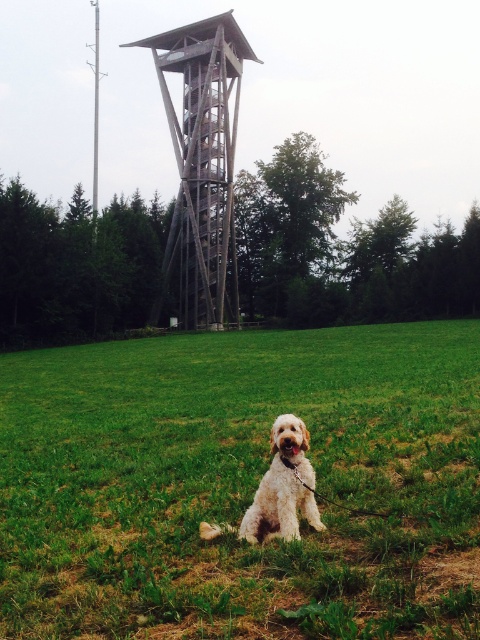
Question: Is green grass at center thinner than wooden tower at center?

Choices:
 (A) yes
 (B) no

Answer: (B)

Question: Which of the following is the farthest from the observer?

Choices:
 (A) green grass at center
 (B) wooden tower at center

Answer: (B)

Question: Is wooden tower at center to the right of golden fur dog at center from the viewer's perspective?

Choices:
 (A) no
 (B) yes

Answer: (A)

Question: Which point is farther from the camera taking this photo?

Choices:
 (A) (180, 305)
 (B) (274, 525)

Answer: (A)

Question: Which of the following is the closest to the observer?

Choices:
 (A) (254, 348)
 (B) (300, 499)

Answer: (B)

Question: Is green grass at center to the left of golden fur dog at center from the viewer's perspective?

Choices:
 (A) no
 (B) yes

Answer: (A)